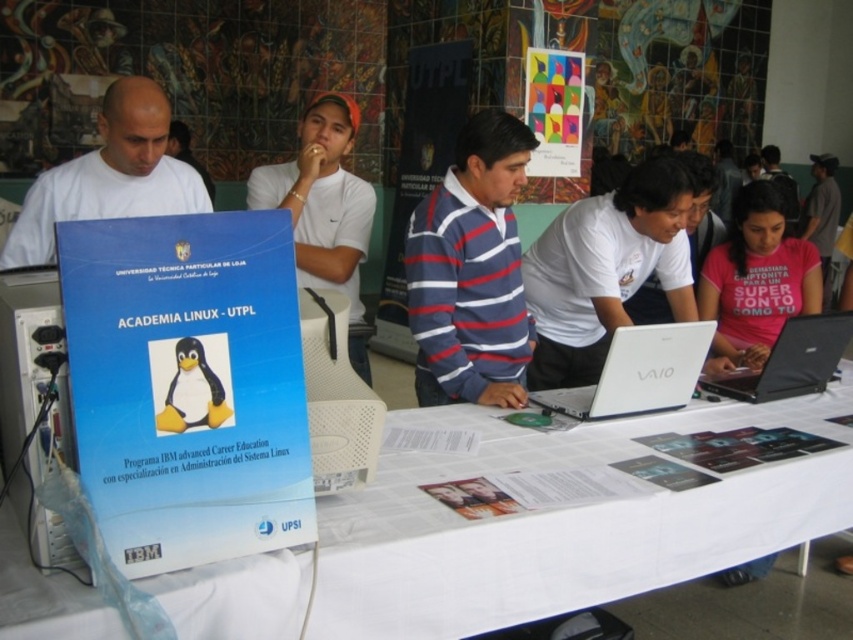
What are the coordinates of the blue plastic computer at lower left?

The coordinates of the blue plastic computer at lower left are at point (33,403).